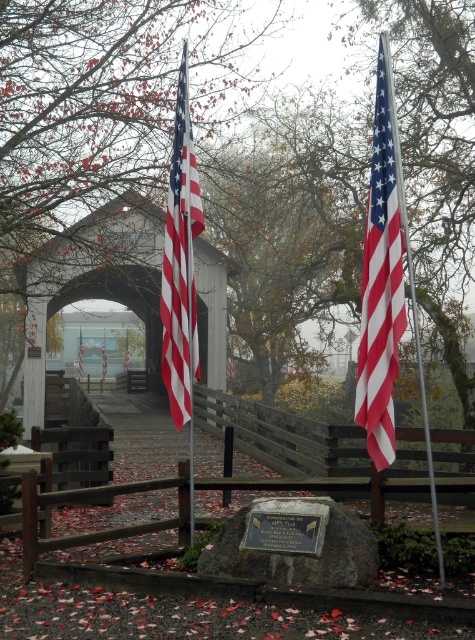
Is matte fabric flag at center thinner than red-white striped flag at center?

In fact, matte fabric flag at center might be wider than red-white striped flag at center.

Can you confirm if matte fabric flag at center is positioned below red-white striped flag at center?

Yes.

Between point (396, 214) and point (177, 125), which one is positioned behind?

The point (177, 125) is more distant.

The width and height of the screenshot is (475, 640). In order to click on matte fabric flag at center in this screenshot , I will do `click(381, 275)`.